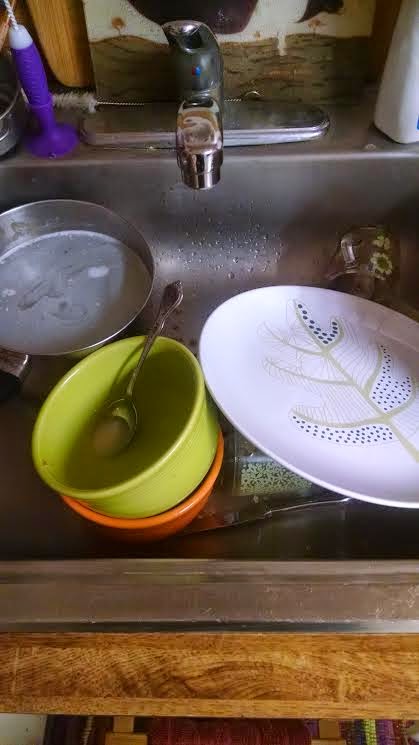
The height and width of the screenshot is (745, 419). I want to click on red hot side of faucet, so click(192, 74).